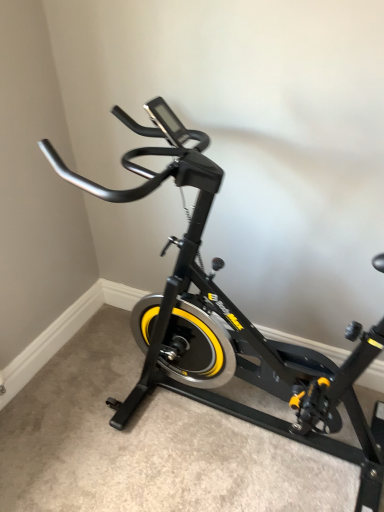
Find the location of a particular element. The width and height of the screenshot is (384, 512). free point below black matte stationary bicycle at center (from a real-world perspective) is located at coordinates (247, 430).